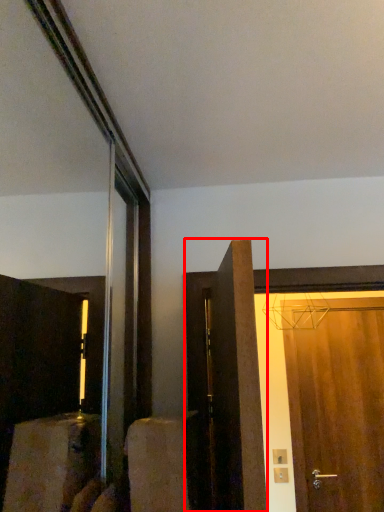
Question: From the image, what is the correct spatial relationship of door (annotated by the red box) in relation to door?

Choices:
 (A) right
 (B) left

Answer: (B)